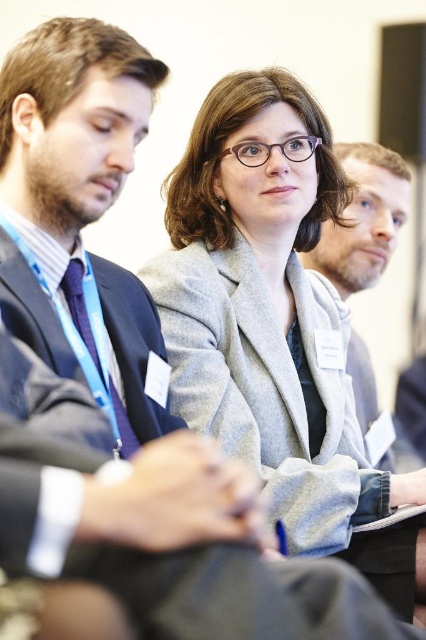
Question: Which object appears farthest from the camera in this image?

Choices:
 (A) gray woolen blazer at center
 (B) gray woolen jacket at center

Answer: (B)

Question: Which point is closer to the camera?

Choices:
 (A) (374, 192)
 (B) (270, 116)

Answer: (B)

Question: Is gray woolen blazer at center behind gray woolen jacket at center?

Choices:
 (A) yes
 (B) no

Answer: (B)

Question: Is gray woolen blazer at center positioned in front of gray woolen jacket at center?

Choices:
 (A) no
 (B) yes

Answer: (B)

Question: Is gray woolen blazer at center to the right of gray woolen jacket at center from the viewer's perspective?

Choices:
 (A) no
 (B) yes

Answer: (A)